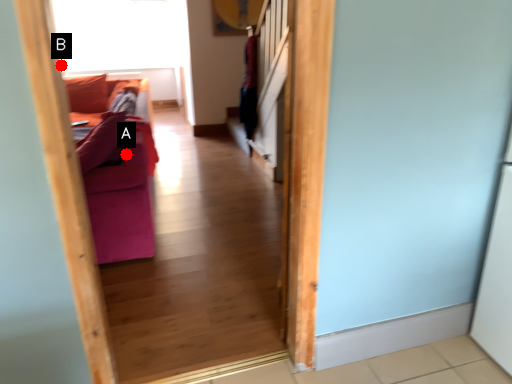
Question: Two points are circled on the image, labeled by A and B beside each circle. Which of the following is the closest to the observer?

Choices:
 (A) A is closer
 (B) B is closer

Answer: (B)